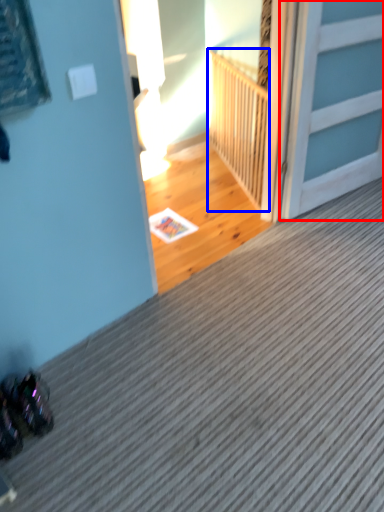
Question: Which object is further to the camera taking this photo, door (highlighted by a red box) or balustrade (highlighted by a blue box)?

Choices:
 (A) door
 (B) balustrade

Answer: (B)